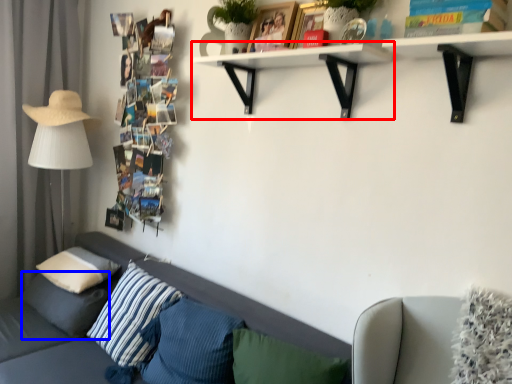
Question: Which object appears closest to the camera in this image, shelf (highlighted by a red box) or pillow (highlighted by a blue box)?

Choices:
 (A) shelf
 (B) pillow

Answer: (A)